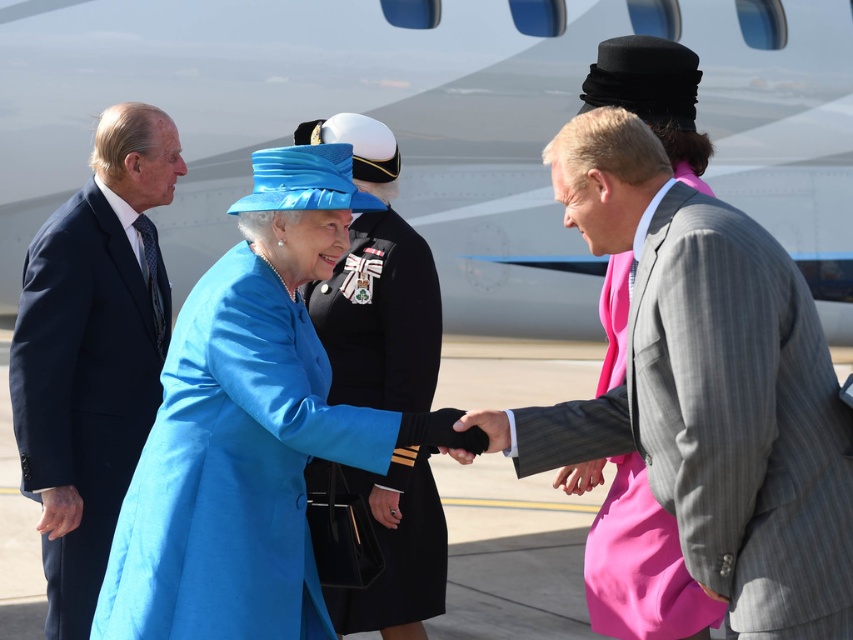
Question: Which point is closer to the camera taking this photo?

Choices:
 (A) (784, 88)
 (B) (838, 627)
 (C) (15, 403)

Answer: (B)

Question: Can you confirm if gray pinstripe suit at center is thinner than satin blue coat at center?

Choices:
 (A) no
 (B) yes

Answer: (B)

Question: Which object appears closest to the camera in this image?

Choices:
 (A) satin blue coat at center
 (B) metallic gray airplane at center
 (C) matte black uniform at center
 (D) gray pinstripe suit at center

Answer: (D)

Question: Based on their relative distances, which object is farther from the navy blue suit at left?

Choices:
 (A) satin blue coat at center
 (B) matte black uniform at center

Answer: (A)

Question: Is navy blue suit at left above matte black uniform at center?

Choices:
 (A) no
 (B) yes

Answer: (A)

Question: Considering the relative positions of gray pinstripe suit at center and navy blue suit at left in the image provided, where is gray pinstripe suit at center located with respect to navy blue suit at left?

Choices:
 (A) below
 (B) above

Answer: (A)